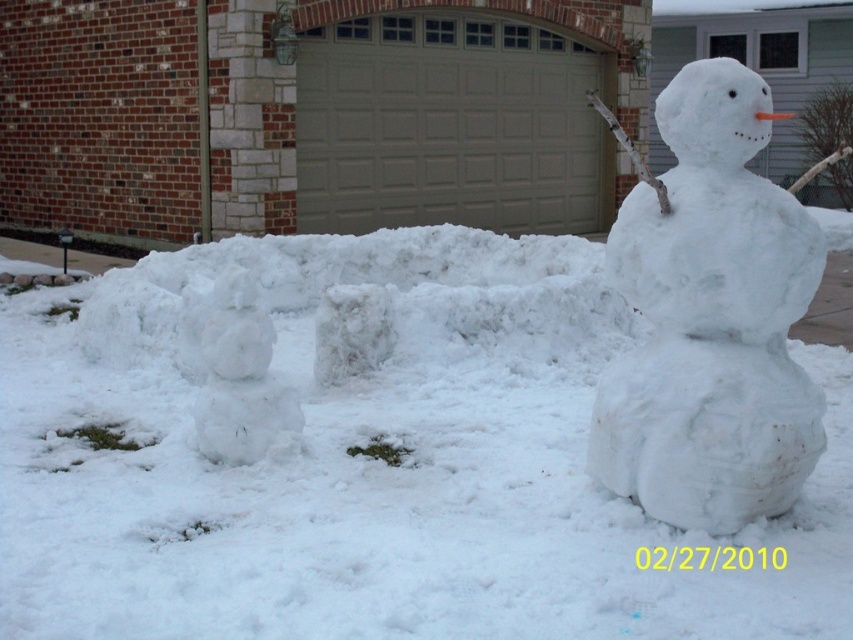
What do you see at coordinates (372, 464) in the screenshot?
I see `white fluffy snow at center` at bounding box center [372, 464].

Is the position of white fluffy snow at center less distant than that of white fluffy snowman at lower left?

No, white fluffy snow at center is further to the viewer.

Which is behind, point (38, 378) or point (201, 344)?

The point (38, 378) is more distant.

The height and width of the screenshot is (640, 853). Identify the location of white fluffy snow at center. (372, 464).

Between gray matte/glossy garage door at center and white fluffy snowman at lower left, which one is positioned lower?

Positioned lower is white fluffy snowman at lower left.

Does point (489, 163) lie in front of point (219, 403)?

No, (489, 163) is further to viewer.

What are the coordinates of `gray matte/glossy garage door at center` in the screenshot? It's located at (445, 125).

Can you confirm if white fluffy snow at center is positioned below white fluffy snowman at right?

Indeed, white fluffy snow at center is positioned under white fluffy snowman at right.

Is white fluffy snow at center wider than white fluffy snowman at right?

No.

Is point (160, 339) positioned after point (796, 484)?

Yes.

At what (x,y) coordinates should I click in order to perform the action: click on white fluffy snow at center. Please return your answer as a coordinate pair (x, y). The image size is (853, 640). Looking at the image, I should click on (372, 464).